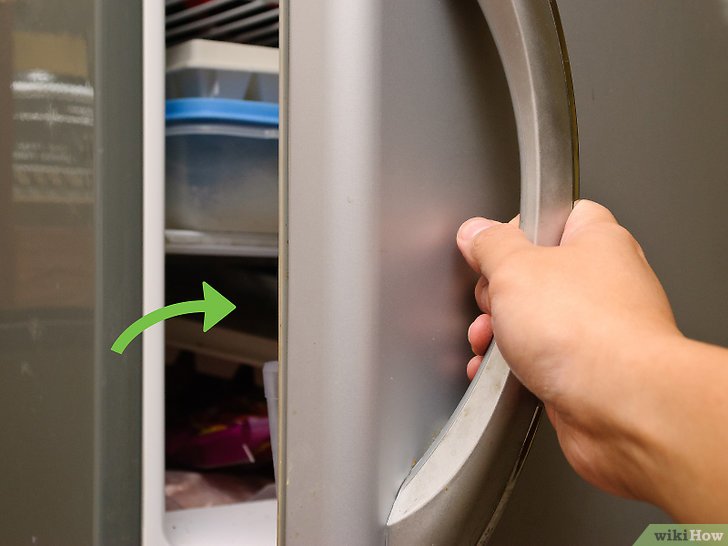
Locate an element on the screen. This screenshot has height=546, width=728. fridge shelves is located at coordinates (221, 521), (201, 240).